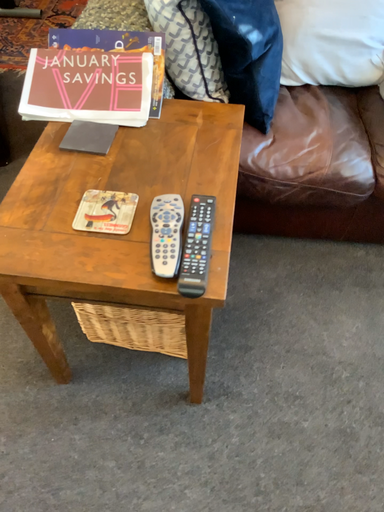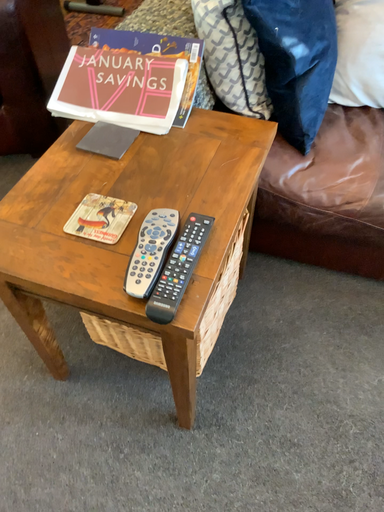
Question: Which way did the camera rotate in the video?

Choices:
 (A) rotated left
 (B) rotated right

Answer: (A)